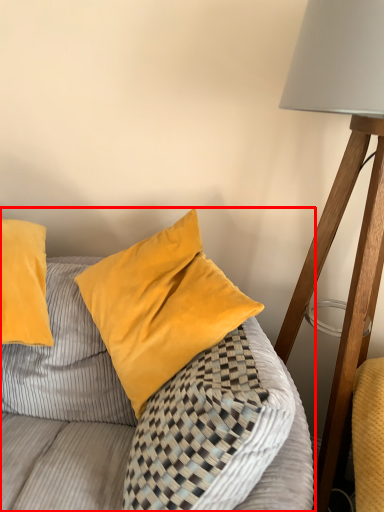
Question: Considering the relative positions of furniture (annotated by the red box) and lamp in the image provided, where is furniture (annotated by the red box) located with respect to the staircase?

Choices:
 (A) left
 (B) right

Answer: (A)